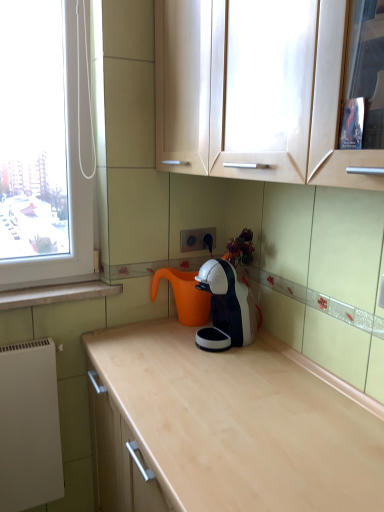
Question: Looking at their shapes, would you say white matte radiator at lower left is wider or thinner than matte wood cabinets at upper center?

Choices:
 (A) thin
 (B) wide

Answer: (A)

Question: Relative to matte wood cabinets at upper center, is white matte radiator at lower left in front or behind?

Choices:
 (A) front
 (B) behind

Answer: (B)

Question: Based on their relative distances, which object is farther from the matte wood cabinets at upper center?

Choices:
 (A) white glossy coffee machine at center
 (B) white glossy coffee machine at center
 (C) white marble window sill at lower left
 (D) white matte radiator at lower left
 (E) white plastic electric outlet at center

Answer: (D)

Question: Which object is the closest to the white glossy coffee machine at center?

Choices:
 (A) white glossy coffee machine at center
 (B) white plastic electric outlet at center
 (C) matte wood cabinets at upper center
 (D) white matte radiator at lower left
 (E) white marble window sill at lower left

Answer: (A)